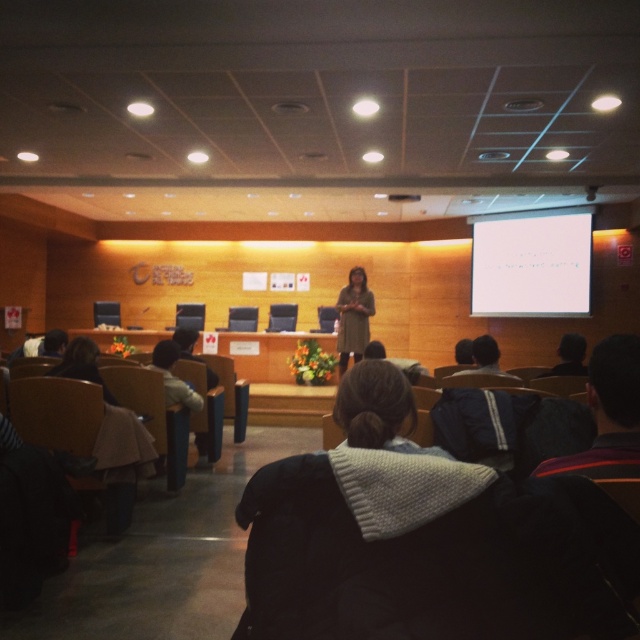
Question: Among these points, which one is nearest to the camera?

Choices:
 (A) (243, 321)
 (B) (356, 349)

Answer: (B)

Question: Where is white matte projection screen at upper center located in relation to wooden chair at center in the image?

Choices:
 (A) left
 (B) right

Answer: (B)

Question: Which object is the closest to the smooth black chair at center?

Choices:
 (A) white matte projection screen at upper center
 (B) wooden chair at center

Answer: (B)

Question: Does white matte projection screen at upper center appear under wooden chair at center?

Choices:
 (A) no
 (B) yes

Answer: (A)

Question: Is white matte projection screen at upper center positioned behind smooth black chair at center?

Choices:
 (A) yes
 (B) no

Answer: (B)

Question: Which of the following is the farthest from the observer?

Choices:
 (A) smooth black chair at center
 (B) white matte projection screen at upper center

Answer: (A)